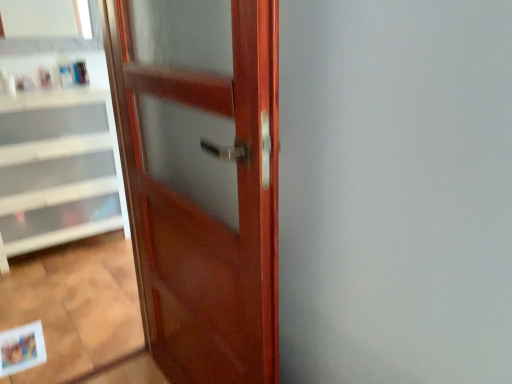
Identify the location of vacant point above matte paper postcard at lower left (from a real-world perspective). This screenshot has width=512, height=384. (13, 340).